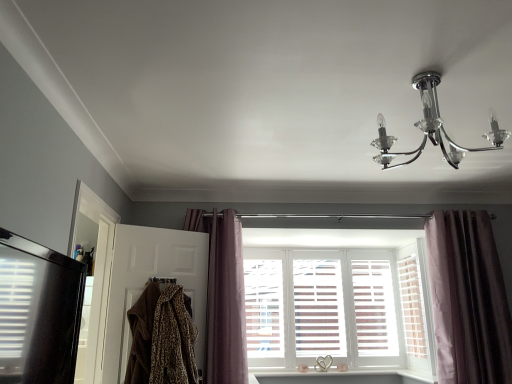
Question: From a real-world perspective, is clear glass chandelier at upper right beneath white wooden window at center?

Choices:
 (A) no
 (B) yes

Answer: (A)

Question: Is clear glass chandelier at upper right to the right of white wooden window at center from the viewer's perspective?

Choices:
 (A) yes
 (B) no

Answer: (A)

Question: Can you confirm if clear glass chandelier at upper right is thinner than white wooden window at center?

Choices:
 (A) no
 (B) yes

Answer: (A)

Question: From the image's perspective, is clear glass chandelier at upper right over white wooden window at center?

Choices:
 (A) yes
 (B) no

Answer: (A)

Question: Is clear glass chandelier at upper right far away from white wooden window at center?

Choices:
 (A) yes
 (B) no

Answer: (A)

Question: Is clear glass chandelier at upper right smaller than white wooden window at center?

Choices:
 (A) yes
 (B) no

Answer: (B)

Question: Is clear glass chandelier at upper right wider than velvet purple curtain at right, the first curtain viewed from the right?

Choices:
 (A) yes
 (B) no

Answer: (A)

Question: Is clear glass chandelier at upper right thinner than velvet purple curtain at right, the first curtain viewed from the right?

Choices:
 (A) no
 (B) yes

Answer: (A)

Question: Is clear glass chandelier at upper right positioned behind velvet purple curtain at right, which ranks as the second curtain in left-to-right order?

Choices:
 (A) yes
 (B) no

Answer: (B)

Question: Is clear glass chandelier at upper right bigger than velvet purple curtain at right, which ranks as the second curtain in left-to-right order?

Choices:
 (A) no
 (B) yes

Answer: (A)

Question: Is clear glass chandelier at upper right positioned in front of velvet purple curtain at right, the first curtain viewed from the right?

Choices:
 (A) no
 (B) yes

Answer: (B)

Question: Is velvet purple curtain at right, the first curtain viewed from the right, at the back of clear glass chandelier at upper right?

Choices:
 (A) yes
 (B) no

Answer: (A)

Question: From a real-world perspective, is brown fur coat at left, which appears as the 2th screen door when viewed from the left, physically below white wood shutter at center?

Choices:
 (A) no
 (B) yes

Answer: (B)